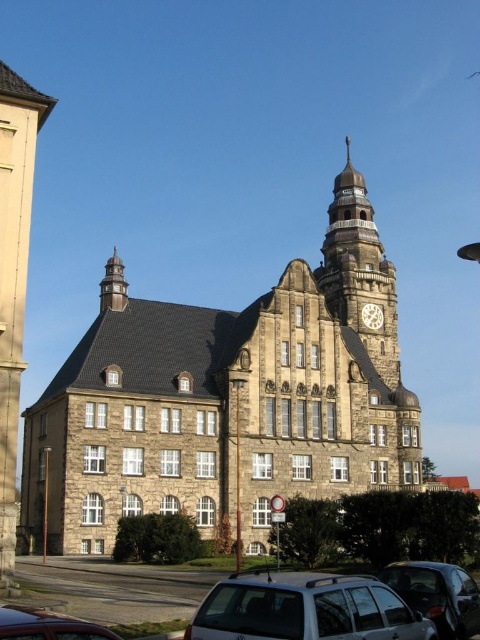
You are a drone operator who needs to fly a drone from the silver metallic car at lower center to the stone clock tower at upper center. Given that the drone can only fly up to 50 meters, will it be able to reach the tower?

The silver metallic car at lower center and the stone clock tower at upper center are 49.75 meters apart from each other. Since the drone can fly up to 50 meters, it will be able to reach the tower as the distance is within its range.

You are standing in front of the historic stone building and want to take a photo of the brown stone clock tower at upper center. Your camera has a maximum zoom range of 50 meters. Can you capture the entire clock tower in your photo without moving closer?

The brown stone clock tower at upper center and camera are 50.96 meters apart. Since the camera can only zoom up to 50 meters, you cannot capture the entire clock tower in your photo without moving closer.

You are standing in front of the historic stone building and see the silver metallic car at lower center and the stone clock tower at upper center. Which object is closer to the ground?

The silver metallic car at lower center is closer to the ground because it is located below the stone clock tower at upper center.